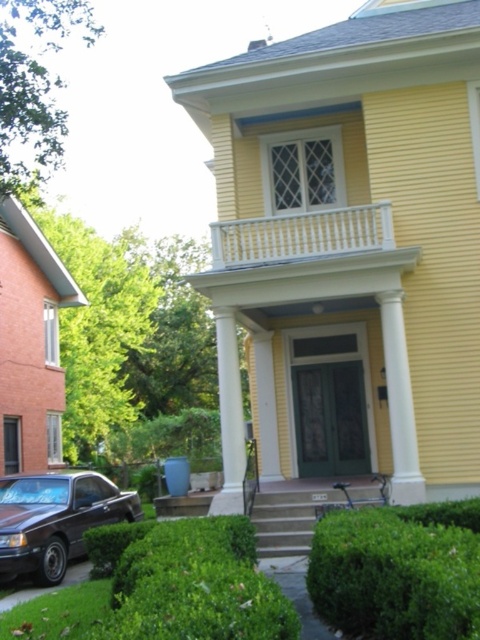
Can you confirm if green leafy hedge at lower right is positioned to the left of shiny brown car at lower left?

In fact, green leafy hedge at lower right is to the right of shiny brown car at lower left.

Which of these two, green leafy hedge at lower right or shiny brown car at lower left, stands shorter?

Standing shorter between the two is green leafy hedge at lower right.

Is point (444, 566) behind point (3, 518)?

No, it is in front of (3, 518).

I want to click on green leafy hedge at lower right, so click(x=398, y=570).

The height and width of the screenshot is (640, 480). What do you see at coordinates (398, 570) in the screenshot?
I see `green leafy hedge at lower right` at bounding box center [398, 570].

Who is higher up, green leafy hedge at lower right or white painted wood railing at upper center?

white painted wood railing at upper center is above.

Where is `green leafy hedge at lower right`? Image resolution: width=480 pixels, height=640 pixels. green leafy hedge at lower right is located at coordinates (398, 570).

Between point (7, 547) and point (309, 212), which one is positioned behind?

The point (309, 212) is more distant.

Looking at this image, is shiny brown car at lower left below white painted wood railing at upper center?

Yes, shiny brown car at lower left is below white painted wood railing at upper center.

The width and height of the screenshot is (480, 640). What do you see at coordinates (56, 518) in the screenshot?
I see `shiny brown car at lower left` at bounding box center [56, 518].

At what (x,y) coordinates should I click in order to perform the action: click on shiny brown car at lower left. Please return your answer as a coordinate pair (x, y). This screenshot has height=640, width=480. Looking at the image, I should click on [x=56, y=518].